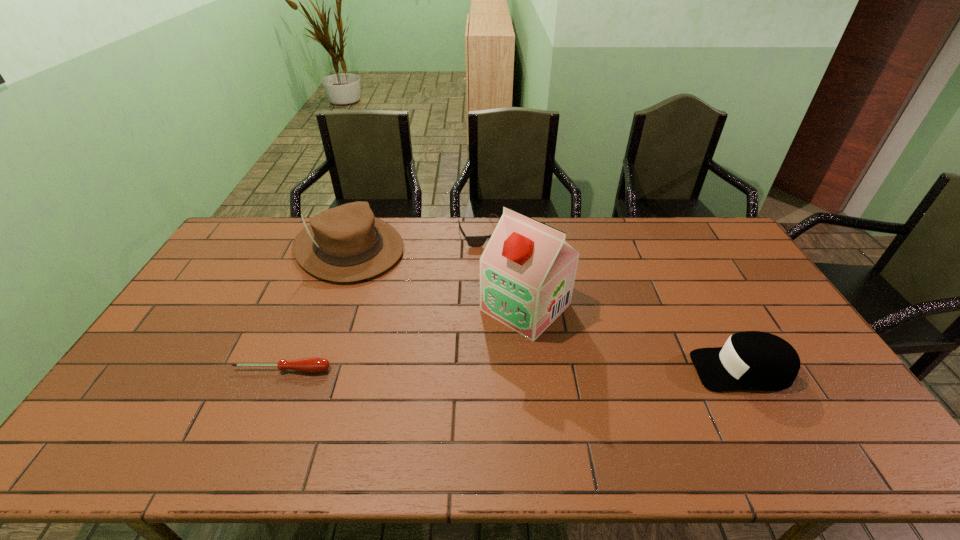
The width and height of the screenshot is (960, 540). What are the coordinates of `screwdriver` in the screenshot? It's located at click(x=313, y=365).

Locate an element on the screen. The image size is (960, 540). the rightmost object is located at coordinates (750, 360).

At what (x,y) coordinates should I click in order to perform the action: click on cap. Please return your answer as a coordinate pair (x, y). The width and height of the screenshot is (960, 540). Looking at the image, I should click on (750, 360).

Find the location of a particular element. The width and height of the screenshot is (960, 540). soya milk is located at coordinates (527, 271).

Where is `the second tallest object`? This screenshot has height=540, width=960. the second tallest object is located at coordinates (346, 243).

At what (x,y) coordinates should I click in order to perform the action: click on the second shortest object. Please return your answer as a coordinate pair (x, y). This screenshot has width=960, height=540. Looking at the image, I should click on (473, 241).

You are a GUI agent. You are given a task and a screenshot of the screen. Output one action in this format:
    pyautogui.click(x=<x>, y=<y>)
    Task: Click on the free space located at the tip of the screwdriver
    
    Given the screenshot: What is the action you would take?
    pyautogui.click(x=272, y=395)

This screenshot has width=960, height=540. I want to click on vacant area situated on the front-facing side of the cap, so click(x=562, y=369).

What are the coordinates of `free space located on the front-facing side of the cap` in the screenshot? It's located at (554, 369).

This screenshot has height=540, width=960. I want to click on blank space located 0.100m on the front-facing side of the cap, so click(657, 369).